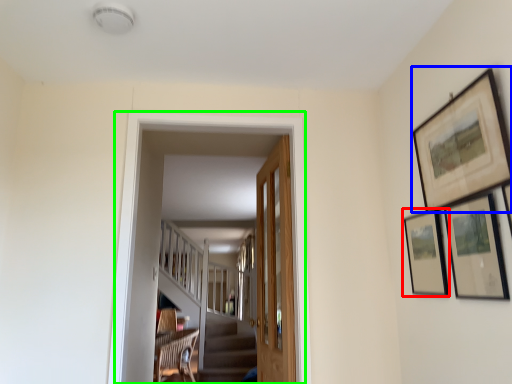
Question: Which object is positioned farthest from picture frame (highlighted by a red box)? Select from picture frame (highlighted by a blue box) and corridor (highlighted by a green box).

Choices:
 (A) picture frame
 (B) corridor

Answer: (B)